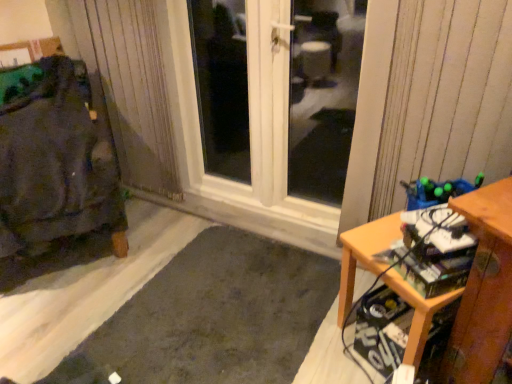
Question: Is transparent glass door at center not within wooden desk at lower right?

Choices:
 (A) yes
 (B) no

Answer: (A)

Question: Is transparent glass door at center shorter than wooden desk at lower right?

Choices:
 (A) no
 (B) yes

Answer: (A)

Question: Would you say wooden desk at lower right is part of transparent glass door at center's contents?

Choices:
 (A) yes
 (B) no

Answer: (B)

Question: Does transparent glass door at center appear on the right side of wooden desk at lower right?

Choices:
 (A) yes
 (B) no

Answer: (B)

Question: From a real-world perspective, does transparent glass door at center sit lower than wooden desk at lower right?

Choices:
 (A) yes
 (B) no

Answer: (B)

Question: Considering the relative sizes of transparent glass door at center and wooden desk at lower right in the image provided, is transparent glass door at center taller than wooden desk at lower right?

Choices:
 (A) no
 (B) yes

Answer: (B)

Question: From the image's perspective, would you say wooden desk at lower right is shown under white plastic window at center?

Choices:
 (A) yes
 (B) no

Answer: (A)

Question: Is wooden desk at lower right thinner than white plastic window at center?

Choices:
 (A) no
 (B) yes

Answer: (A)

Question: Is wooden desk at lower right not near white plastic window at center?

Choices:
 (A) no
 (B) yes

Answer: (B)

Question: Is wooden desk at lower right surrounding white plastic window at center?

Choices:
 (A) yes
 (B) no

Answer: (B)

Question: Does wooden desk at lower right have a lesser height compared to white plastic window at center?

Choices:
 (A) no
 (B) yes

Answer: (B)

Question: From the image's perspective, is wooden desk at lower right located above white plastic window at center?

Choices:
 (A) yes
 (B) no

Answer: (B)

Question: Considering the relative sizes of dark gray fabric at left and wooden desk at lower right in the image provided, is dark gray fabric at left bigger than wooden desk at lower right?

Choices:
 (A) yes
 (B) no

Answer: (A)